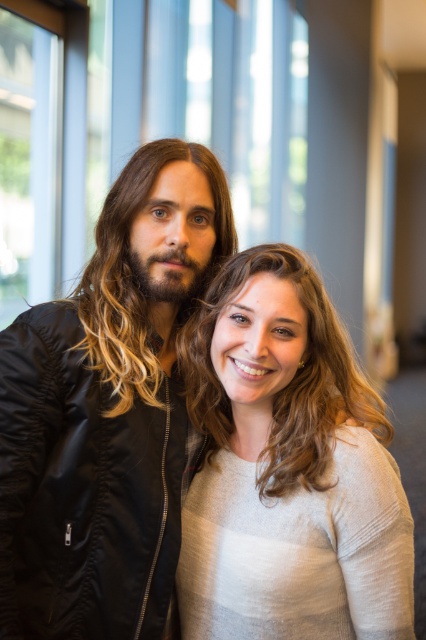
You are taking a photo of two people standing indoors. You notice a point at coordinates (287, 468). Which person is closest to this point? The person on the left or the one on the right?

The point at coordinates (287, 468) indicates the light gray sweater at center, so the individual on the right is closest to this point since they are wearing the light gray sweater.

You are a photographer adjusting a camera tripod. You need to ensure that both the light gray sweater at center and the brownsmoothhair at center are fully visible in your shot. Which object should you focus on to frame the shot properly?

The light gray sweater at center has a greater height compared to brownsmoothhair at center, so you should focus on the light gray sweater at center to ensure the entire height of both objects is captured in the frame.

In the scene shown: You are taking a photo of two people standing in a room with a large window. You notice the light gray sweater at center and the brownsmoothhair at center. Which object is positioned to the right side from your perspective?

The light gray sweater at center is to the right of the brownsmoothhair at center.